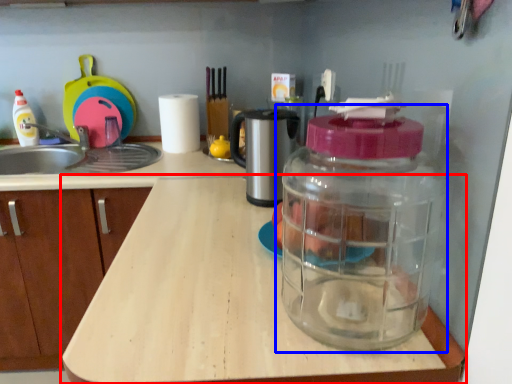
Question: Which of the following is the closest to the observer, countertop (highlighted by a red box) or bottle (highlighted by a blue box)?

Choices:
 (A) countertop
 (B) bottle

Answer: (B)